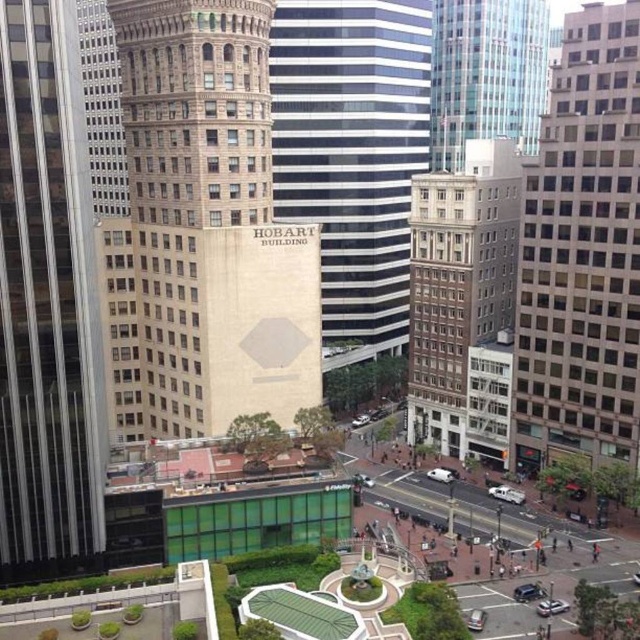
Can you confirm if glassy steel skyscraper at center is bigger than glassy reflective skyscraper at upper center?

Actually, glassy steel skyscraper at center might be smaller than glassy reflective skyscraper at upper center.

Is glassy steel skyscraper at center further to the viewer compared to glassy reflective skyscraper at upper center?

No, it is not.

Is point (29, 536) farther from camera compared to point (513, 68)?

No.

Where is `glassy steel skyscraper at center`? The width and height of the screenshot is (640, 640). glassy steel skyscraper at center is located at coordinates (48, 304).

Is point (349, 173) more distant than point (476, 104)?

No, it is not.

Consider the image. Which is above, black and white striped building at center or glassy reflective skyscraper at upper center?

glassy reflective skyscraper at upper center is higher up.

This screenshot has height=640, width=640. What do you see at coordinates (353, 154) in the screenshot? I see `black and white striped building at center` at bounding box center [353, 154].

This screenshot has height=640, width=640. I want to click on black and white striped building at center, so tap(353, 154).

The height and width of the screenshot is (640, 640). In order to click on beige glass building at right in this screenshot , I will do `click(580, 253)`.